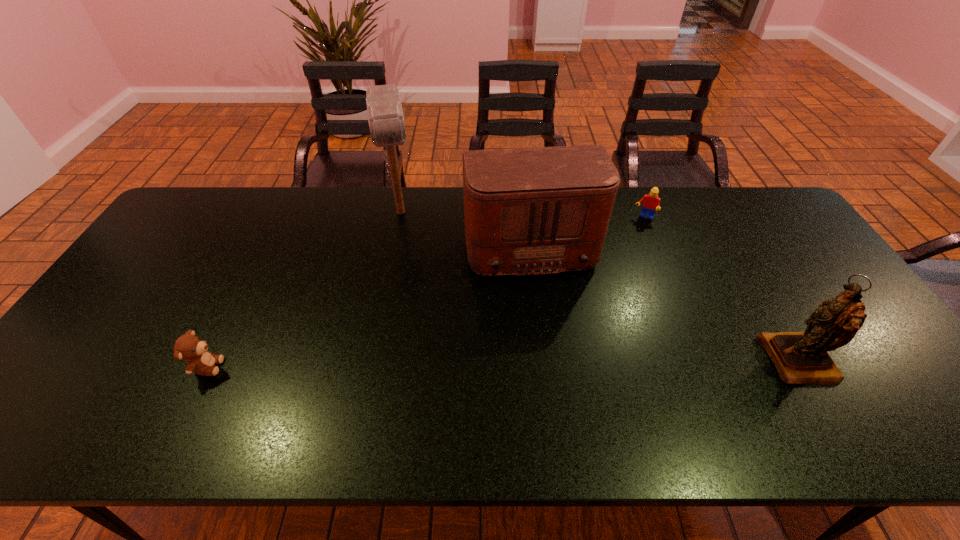
Where is `vacant space situated 0.110m on the front panel of the radio receiver`? vacant space situated 0.110m on the front panel of the radio receiver is located at coordinates (547, 315).

At what (x,y) coordinates should I click in order to perform the action: click on vacant space located on the front panel of the radio receiver. Please return your answer as a coordinate pair (x, y). The image size is (960, 540). Looking at the image, I should click on (557, 356).

Identify the location of free region located 0.070m on the front panel of the radio receiver. The image size is (960, 540). (544, 303).

In order to click on free space located 0.310m on the striking face of the second object from left to right in this screenshot , I will do `click(410, 303)`.

Identify the location of free region located on the striking face of the second object from left to right. (404, 252).

This screenshot has width=960, height=540. What are the coordinates of `free region located 0.160m on the striking face of the second object from left to right` in the screenshot? It's located at (405, 266).

Where is `free space located 0.390m on the front-facing side of the Lego`? free space located 0.390m on the front-facing side of the Lego is located at coordinates (612, 303).

This screenshot has height=540, width=960. Find the location of `free space located 0.290m on the front-facing side of the Lego`. free space located 0.290m on the front-facing side of the Lego is located at coordinates (620, 280).

The image size is (960, 540). Find the location of `free space located on the front-facing side of the Lego`. free space located on the front-facing side of the Lego is located at coordinates click(x=628, y=258).

Find the location of a particular element. The image size is (960, 540). radio receiver that is at the far edge is located at coordinates (527, 211).